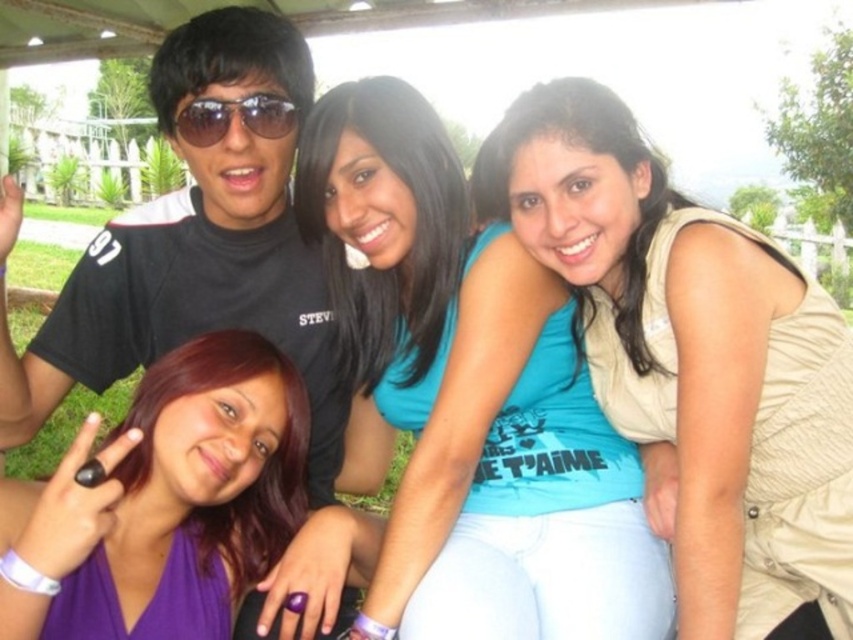
Does black matte shirt at upper left have a greater width compared to purple fabric dress at lower left?

Yes.

The width and height of the screenshot is (853, 640). Find the location of `black matte shirt at upper left`. black matte shirt at upper left is located at coordinates (209, 285).

Does blue fabric shirt at center have a greater height compared to black matte shirt at upper left?

No, blue fabric shirt at center is not taller than black matte shirt at upper left.

Can you confirm if blue fabric shirt at center is positioned above black matte shirt at upper left?

Incorrect, blue fabric shirt at center is not positioned above black matte shirt at upper left.

Does point (624, 336) lie in front of point (238, 273)?

Yes, it is.

The image size is (853, 640). Identify the location of blue fabric shirt at center. (698, 364).

Does blue fabric shirt at center appear over purple fabric dress at lower left?

Yes, blue fabric shirt at center is above purple fabric dress at lower left.

Between blue fabric shirt at center and purple fabric dress at lower left, which one appears on the left side from the viewer's perspective?

From the viewer's perspective, purple fabric dress at lower left appears more on the left side.

Is point (606, 195) positioned behind point (125, 611)?

Yes, point (606, 195) is farther from viewer.

Find the location of a particular element. blue fabric shirt at center is located at coordinates (698, 364).